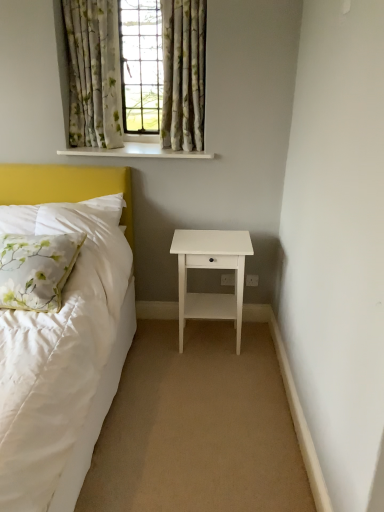
Question: Does floral fabric curtains at upper center, the 1th curtain in the left-to-right sequence, have a lesser width compared to floral fabric curtain at upper center?

Choices:
 (A) no
 (B) yes

Answer: (B)

Question: Does floral fabric curtains at upper center, which is counted as the 2th curtain, starting from the right, appear on the left side of floral fabric curtain at upper center?

Choices:
 (A) no
 (B) yes

Answer: (B)

Question: Is there a large distance between floral fabric curtains at upper center, the 1th curtain in the left-to-right sequence, and floral fabric curtain at upper center?

Choices:
 (A) yes
 (B) no

Answer: (B)

Question: Does floral fabric curtains at upper center, the 1th curtain in the left-to-right sequence, have a lesser height compared to floral fabric curtain at upper center?

Choices:
 (A) yes
 (B) no

Answer: (A)

Question: Is floral fabric curtains at upper center, which is counted as the 2th curtain, starting from the right, not within floral fabric curtain at upper center?

Choices:
 (A) yes
 (B) no

Answer: (B)

Question: From a real-world perspective, is floral fabric curtains at upper center, the 1th curtain in the left-to-right sequence, physically above floral fabric curtain at upper center?

Choices:
 (A) yes
 (B) no

Answer: (B)

Question: Is white floral fabric pillow at left to the left of white glossy window sill at upper center from the viewer's perspective?

Choices:
 (A) no
 (B) yes

Answer: (B)

Question: Is white floral fabric pillow at left smaller than white glossy window sill at upper center?

Choices:
 (A) yes
 (B) no

Answer: (B)

Question: Can you see white floral fabric pillow at left touching white glossy window sill at upper center?

Choices:
 (A) yes
 (B) no

Answer: (B)

Question: Is white floral fabric pillow at left far from white glossy window sill at upper center?

Choices:
 (A) no
 (B) yes

Answer: (A)

Question: From the image's perspective, does white floral fabric pillow at left appear higher than white glossy window sill at upper center?

Choices:
 (A) no
 (B) yes

Answer: (A)

Question: Is white floral fabric pillow at left oriented away from white glossy window sill at upper center?

Choices:
 (A) yes
 (B) no

Answer: (B)

Question: From a real-world perspective, does white glossy nightstand at lower right sit lower than floral fabric curtains at upper center, which ranks as the second curtain in left-to-right order?

Choices:
 (A) yes
 (B) no

Answer: (A)